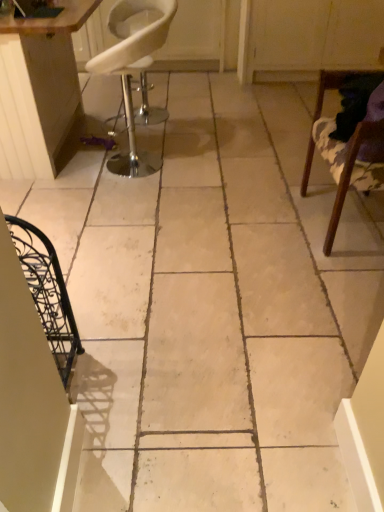
At what (x,y) coordinates should I click in order to perform the action: click on free spot to the left of wooden chair at right, which ranks as the second chair in left-to-right order. Please return your answer as a coordinate pair (x, y). This screenshot has width=384, height=512. Looking at the image, I should click on (258, 224).